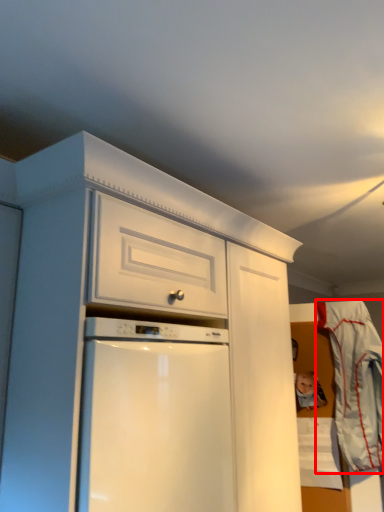
Question: From the image, what is the correct spatial relationship of laundry (annotated by the red box) in relation to toy?

Choices:
 (A) left
 (B) right

Answer: (B)